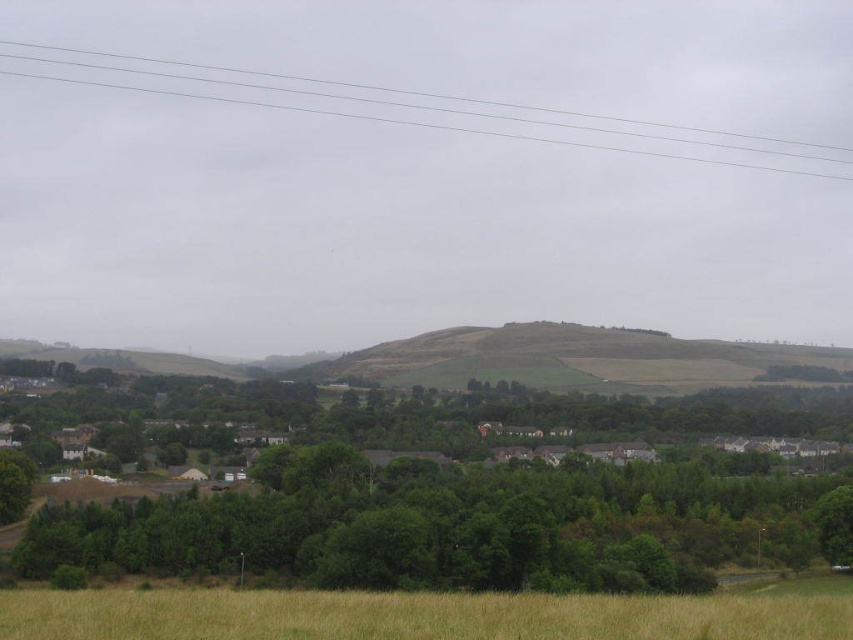
Question: Where is green leafy tree at lower center located in relation to clear plastic power lines at upper center in the image?

Choices:
 (A) above
 (B) below

Answer: (B)

Question: Does brown grassy field at lower center have a greater width compared to clear plastic power lines at upper center?

Choices:
 (A) yes
 (B) no

Answer: (B)

Question: Which of the following is the farthest from the observer?

Choices:
 (A) (473, 634)
 (B) (537, 513)
 (C) (619, 125)

Answer: (C)

Question: Which object is closer to the camera taking this photo?

Choices:
 (A) brown grassy field at lower center
 (B) clear plastic power lines at upper center

Answer: (A)

Question: Which point is farther to the camera?

Choices:
 (A) (32, 72)
 (B) (108, 524)

Answer: (A)

Question: Is brown grassy field at lower center bigger than clear plastic power lines at upper center?

Choices:
 (A) no
 (B) yes

Answer: (A)